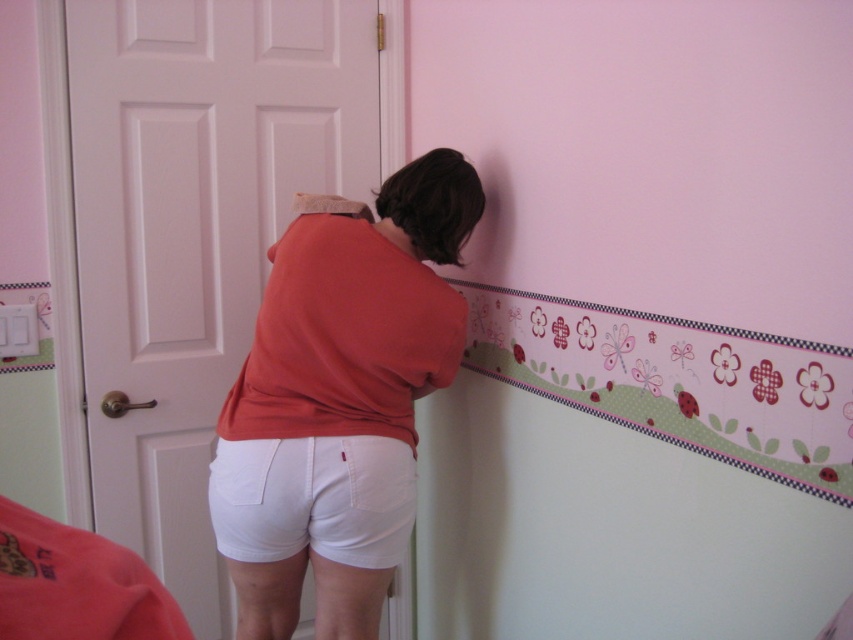
You are an interior designer assessing the placement of clothing items in the scene. Which object, the matte orange shirt at center or the white cotton shorts at lower center, occupies a higher position in the image?

The matte orange shirt at center has a greater height compared to the white cotton shorts at lower center, so the matte orange shirt at center occupies a higher position in the image.

You are a fashion designer observing the person in the image. You need to determine which clothing item is wider between the matte orange shirt at center and the white cotton shorts at lower center. Which one is wider?

The matte orange shirt at center is wider than the white cotton shorts at lower center according to the description.

You are an interior designer assessing the wall decorations. You notice two points marked on the wall. The first point is at coordinate point(328, 596) and the second is at point(222, 444). From the perspective of someone standing in front of the wall, which point is closer to you?

Point(222, 444) is closer to you because it is in front of point(328, 596).